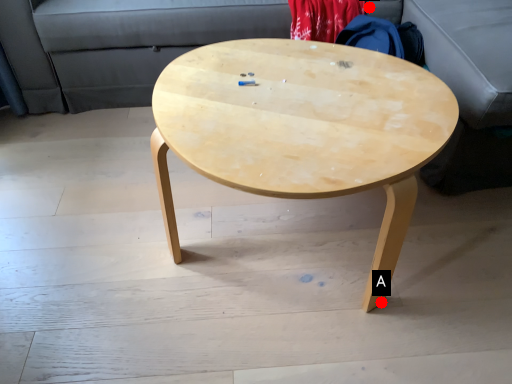
Question: Two points are circled on the image, labeled by A and B beside each circle. Which of the following is the closest to the observer?

Choices:
 (A) A is closer
 (B) B is closer

Answer: (A)